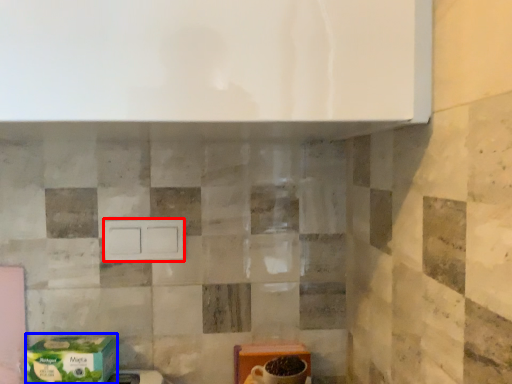
Question: Among these objects, which one is farthest to the camera, drawer (highlighted by a red box) or cardboard box (highlighted by a blue box)?

Choices:
 (A) drawer
 (B) cardboard box

Answer: (A)